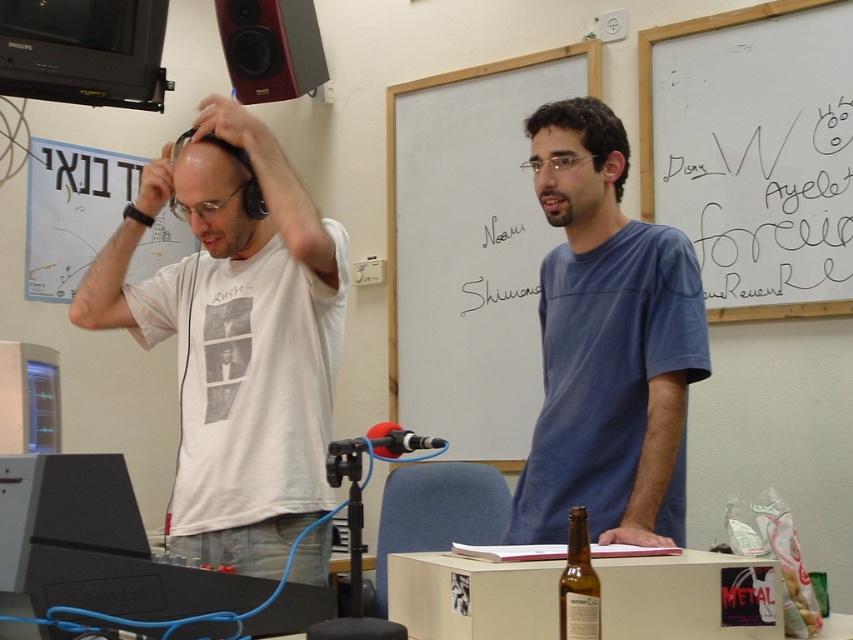
Which is in front, point (728, 90) or point (358, 444)?

Point (358, 444)

Which is above, white matte whiteboard at upper center or red foam microphone at center?

Positioned higher is white matte whiteboard at upper center.

Locate an element on the screen. white matte whiteboard at upper center is located at coordinates (753, 152).

Locate an element on the screen. The width and height of the screenshot is (853, 640). red foam microphone at center is located at coordinates (386, 442).

Describe the element at coordinates (386, 442) in the screenshot. I see `red foam microphone at center` at that location.

Describe the element at coordinates (386, 442) in the screenshot. The height and width of the screenshot is (640, 853). I see `red foam microphone at center` at that location.

At what (x,y) coordinates should I click in order to perform the action: click on red foam microphone at center. Please return your answer as a coordinate pair (x, y). Looking at the image, I should click on (386, 442).

Which is above, white matte t-shirt at left or white matte whiteboard at upper center?

white matte whiteboard at upper center is above.

Which is in front, point (305, 577) or point (804, 13)?

Point (305, 577) is more forward.

Who is more forward, (x=299, y=276) or (x=766, y=3)?

Point (x=299, y=276) is more forward.

Identify the location of white matte t-shirt at left. The width and height of the screenshot is (853, 640). (236, 339).